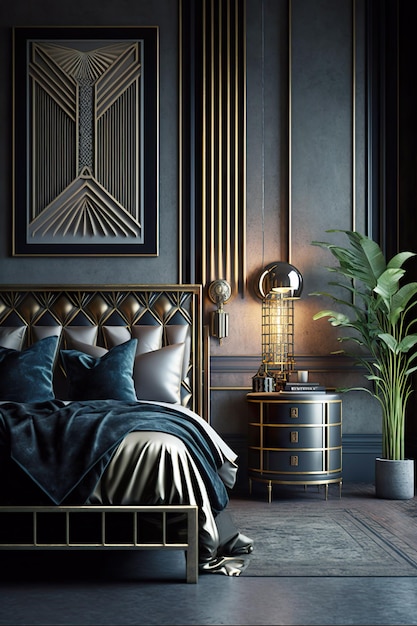
Where is `blanket`? This screenshot has width=417, height=626. blanket is located at coordinates (57, 436), (93, 471), (181, 436).